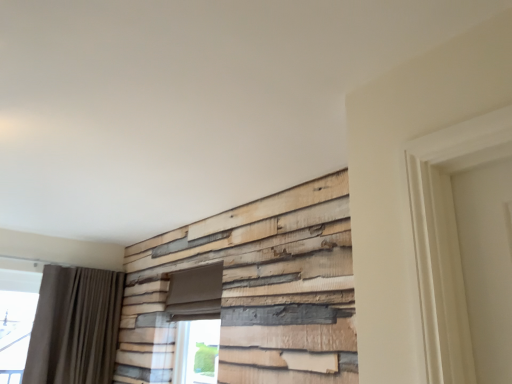
What do you see at coordinates (75, 326) in the screenshot? I see `dark gray fabric curtain at left` at bounding box center [75, 326].

Locate an element on the screen. Image resolution: width=512 pixels, height=384 pixels. dark gray fabric curtain at left is located at coordinates (75, 326).

The width and height of the screenshot is (512, 384). What are the coordinates of `green glass window at lower center` in the screenshot? It's located at (196, 351).

What do you see at coordinates (196, 351) in the screenshot?
I see `green glass window at lower center` at bounding box center [196, 351].

Find the location of a particular element. dark gray fabric curtain at left is located at coordinates (75, 326).

Which is more to the left, dark gray fabric curtain at left or green glass window at lower center?

From the viewer's perspective, dark gray fabric curtain at left appears more on the left side.

Which object is closer to the camera taking this photo, dark gray fabric curtain at left or green glass window at lower center?

green glass window at lower center.

Does point (55, 348) come behind point (217, 333)?

Yes, point (55, 348) is farther from viewer.

From the image's perspective, which object appears higher, dark gray fabric curtain at left or green glass window at lower center?

dark gray fabric curtain at left, from the image's perspective.

From a real-world perspective, which object stands above the other?

dark gray fabric curtain at left is physically above.

Which of these two, dark gray fabric curtain at left or green glass window at lower center, is wider?

Wider between the two is dark gray fabric curtain at left.

Looking at this image, between dark gray fabric curtain at left and green glass window at lower center, which one has more height?

dark gray fabric curtain at left.

Considering the relative sizes of dark gray fabric curtain at left and green glass window at lower center in the image provided, is dark gray fabric curtain at left bigger than green glass window at lower center?

Yes, dark gray fabric curtain at left is bigger than green glass window at lower center.

Looking at this image, could green glass window at lower center be considered to be inside dark gray fabric curtain at left?

No, green glass window at lower center is located outside of dark gray fabric curtain at left.

Is dark gray fabric curtain at left positioned far away from green glass window at lower center?

dark gray fabric curtain at left is near green glass window at lower center, not far away.

In the scene shown: Does dark gray fabric curtain at left turn towards green glass window at lower center?

No, dark gray fabric curtain at left is not turned towards green glass window at lower center.

Looking at this image, how different are the orientations of dark gray fabric curtain at left and green glass window at lower center in degrees?

The facing directions of dark gray fabric curtain at left and green glass window at lower center are 82.6 degrees apart.

At what (x,y) coordinates should I click in order to perform the action: click on curtain that is above the green glass window at lower center (from a real-world perspective). Please return your answer as a coordinate pair (x, y). This screenshot has width=512, height=384. Looking at the image, I should click on (75, 326).

In the scene shown: Between green glass window at lower center and dark gray fabric curtain at left, which one appears on the left side from the viewer's perspective?

dark gray fabric curtain at left.

Which is behind, green glass window at lower center or dark gray fabric curtain at left?

Positioned behind is dark gray fabric curtain at left.

Which is closer to the camera, [214,339] or [64,356]?

Point [214,339]

From the image's perspective, relative to dark gray fabric curtain at left, is green glass window at lower center above or below?

From the image's perspective, green glass window at lower center appears below dark gray fabric curtain at left.

From a real-world perspective, between green glass window at lower center and dark gray fabric curtain at left, who is vertically lower?

green glass window at lower center is physically lower.

Considering the relative sizes of green glass window at lower center and dark gray fabric curtain at left in the image provided, is green glass window at lower center thinner than dark gray fabric curtain at left?

Indeed, green glass window at lower center has a lesser width compared to dark gray fabric curtain at left.

Consider the image. Who is shorter, green glass window at lower center or dark gray fabric curtain at left?

With less height is green glass window at lower center.

Looking at this image, between green glass window at lower center and dark gray fabric curtain at left, which one has smaller size?

green glass window at lower center is smaller.

Is green glass window at lower center spatially inside dark gray fabric curtain at left, or outside of it?

The correct answer is: outside.

Based on the photo, are green glass window at lower center and dark gray fabric curtain at left located far from each other?

No, green glass window at lower center is in close proximity to dark gray fabric curtain at left.

Is green glass window at lower center turned away from dark gray fabric curtain at left?

That's not correct — green glass window at lower center is not looking away from dark gray fabric curtain at left.

Where is `curtain on the left of green glass window at lower center`? The height and width of the screenshot is (384, 512). curtain on the left of green glass window at lower center is located at coordinates (75, 326).

This screenshot has width=512, height=384. Identify the location of window below the dark gray fabric curtain at left (from the image's perspective). (196, 351).

Image resolution: width=512 pixels, height=384 pixels. I want to click on curtain behind the green glass window at lower center, so click(x=75, y=326).